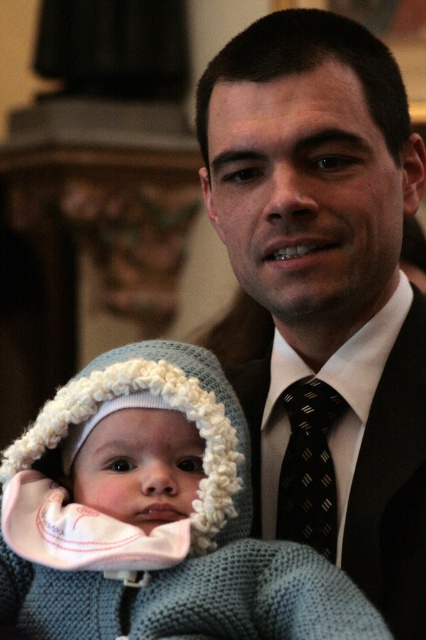
Can you confirm if knitted blue hat at center is positioned to the right of black dotted tie at center?

No, knitted blue hat at center is not to the right of black dotted tie at center.

Can you confirm if knitted blue hat at center is shorter than black dotted tie at center?

No, knitted blue hat at center is not shorter than black dotted tie at center.

Find the location of a particular element. This screenshot has height=640, width=426. knitted blue hat at center is located at coordinates (157, 518).

Is knitted blue hat at center wider than black silk tie at center?

Yes, knitted blue hat at center is wider than black silk tie at center.

You are a GUI agent. You are given a task and a screenshot of the screen. Output one action in this format:
    pyautogui.click(x=<x>, y=<y>)
    Task: Click on the knitted blue hat at center
    The height and width of the screenshot is (640, 426).
    Given the screenshot: What is the action you would take?
    pyautogui.click(x=157, y=518)

Does matte black suit at center have a greater height compared to knitted blue hat at center?

Indeed, matte black suit at center has a greater height compared to knitted blue hat at center.

Can you confirm if matte black suit at center is shorter than knitted blue hat at center?

In fact, matte black suit at center may be taller than knitted blue hat at center.

Does point (419, 556) come farther from viewer compared to point (54, 627)?

Yes, it is behind point (54, 627).

What are the coordinates of `matte black suit at center` in the screenshot? It's located at (324, 284).